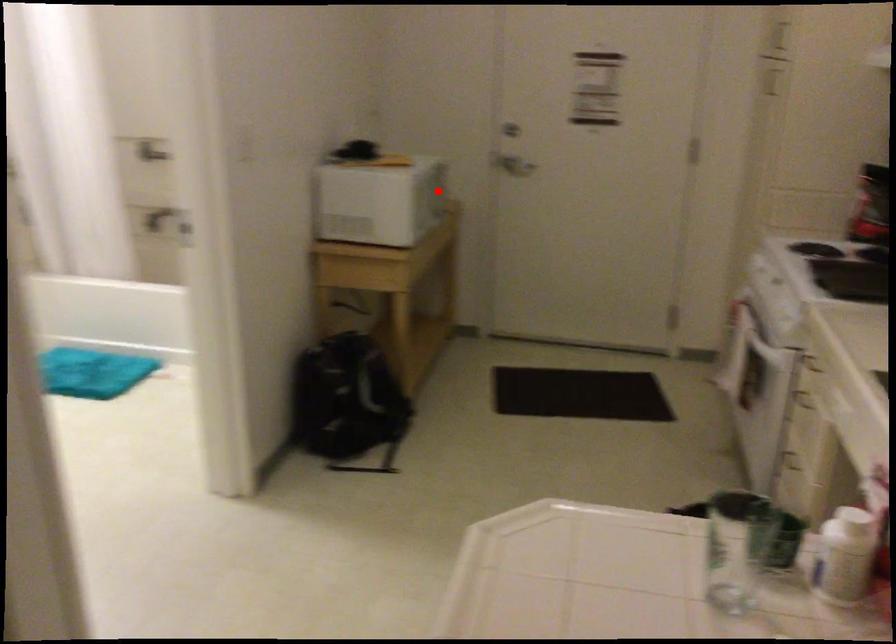
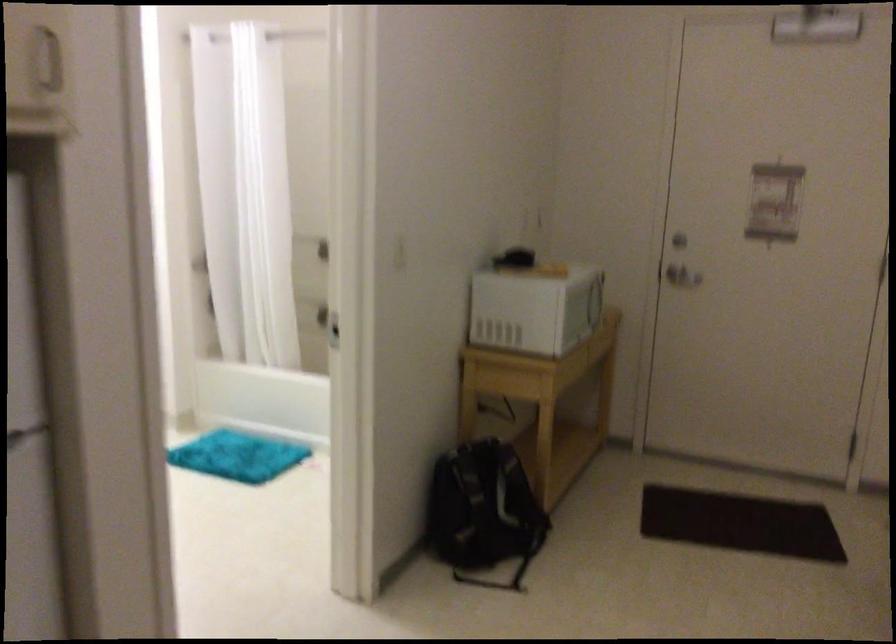
The point at the highlighted location is marked in the first image. Where is the corresponding point in the second image?

(596, 301)